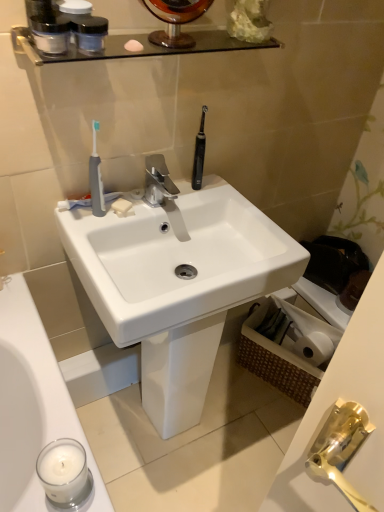
Identify the location of free location to the right of gray rubber toothbrush at left. (160, 205).